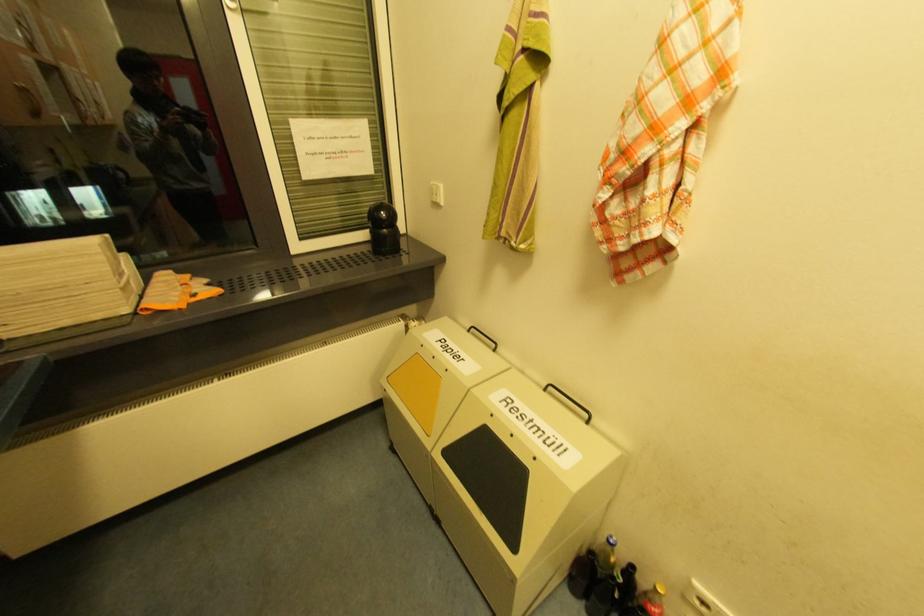
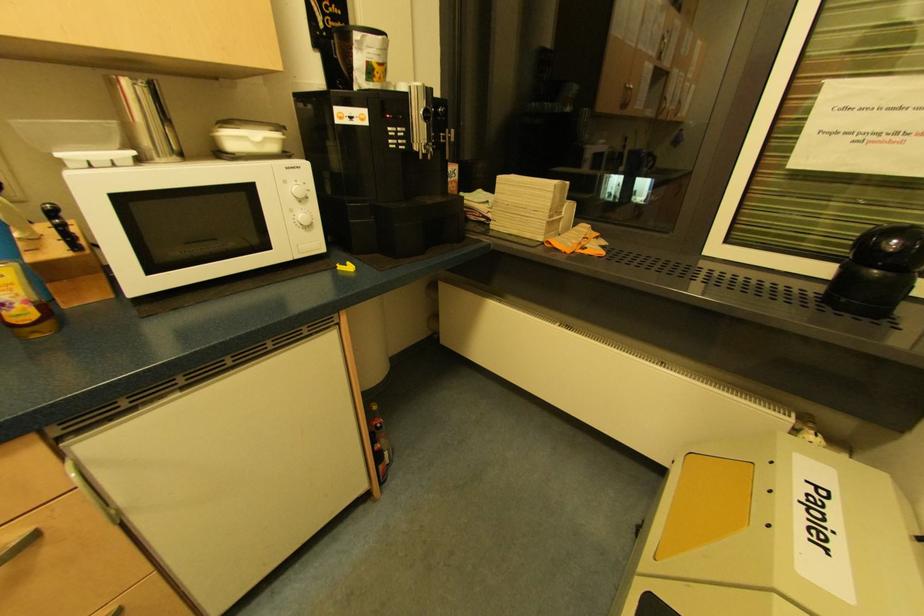
In the second image, find the point that corresponds to point (385, 213) in the first image.

(897, 241)